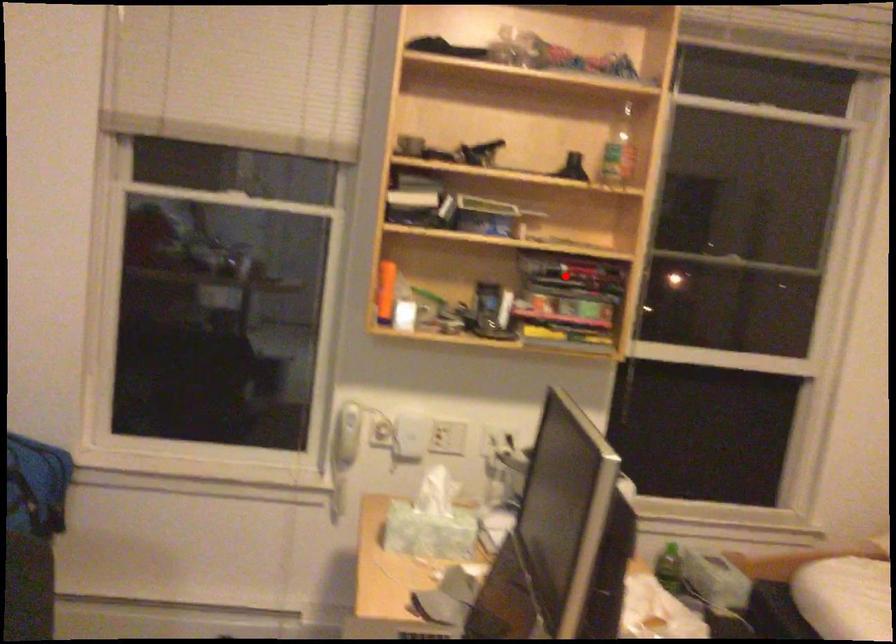
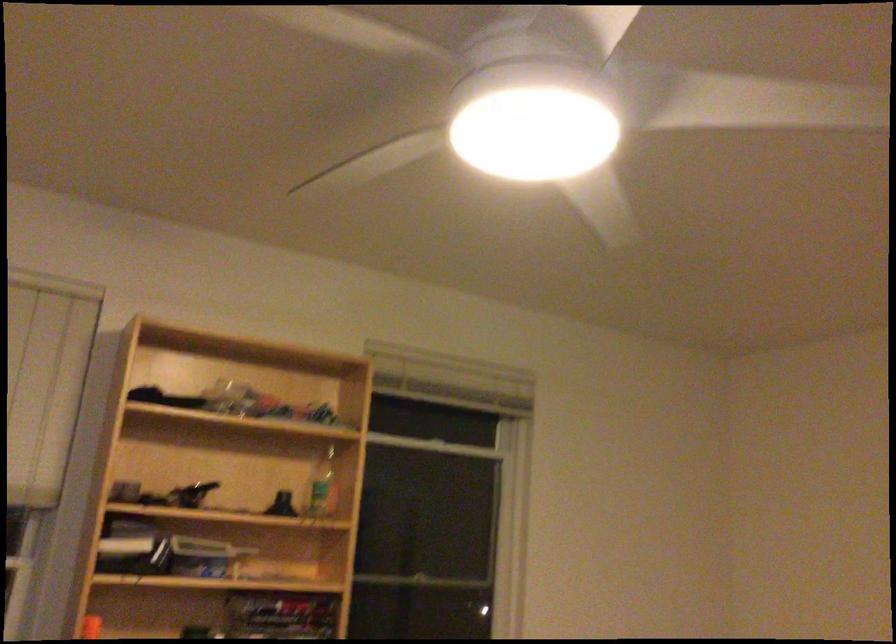
Locate, in the second image, the point that corresponds to the highlighted location in the first image.

(281, 614)